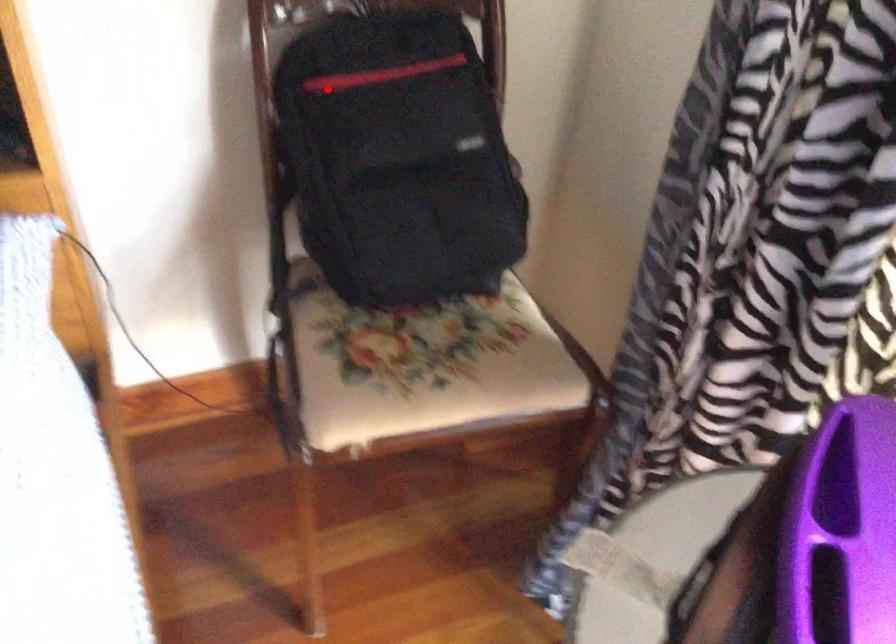
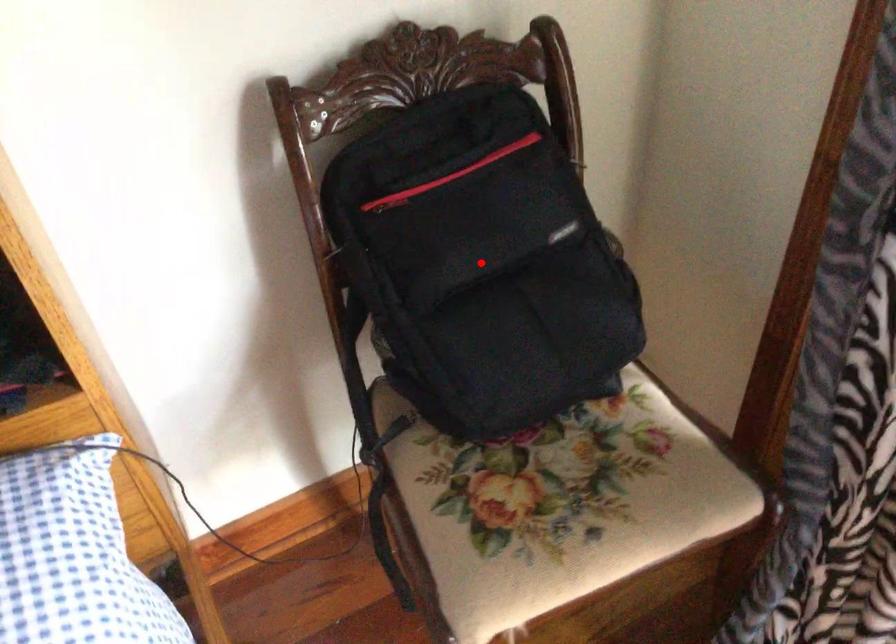
I am providing you with two images of the same scene from different viewpoints. A red point is marked on the first image and another point is marked on the second image. Is the red point in image1 aligned with the point shown in image2?

No